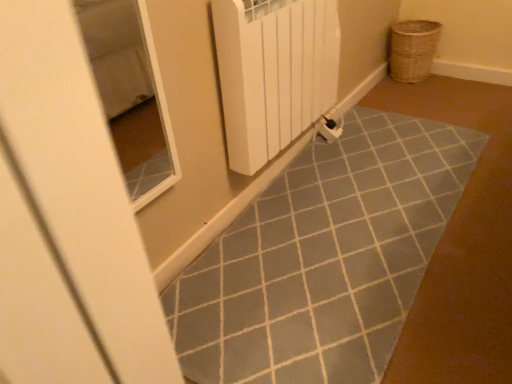
Image resolution: width=512 pixels, height=384 pixels. In order to click on white plastic radiator at center in this screenshot , I will do `click(273, 73)`.

Describe the element at coordinates (273, 73) in the screenshot. This screenshot has width=512, height=384. I see `white plastic radiator at center` at that location.

The height and width of the screenshot is (384, 512). What do you see at coordinates (412, 50) in the screenshot?
I see `woven brown basket at upper right` at bounding box center [412, 50].

Where is `woven brown basket at upper right`? This screenshot has width=512, height=384. woven brown basket at upper right is located at coordinates (412, 50).

The image size is (512, 384). I want to click on white plastic radiator at center, so click(x=273, y=73).

Is white plastic radiator at center to the right of woven brown basket at upper right from the viewer's perspective?

No, white plastic radiator at center is not to the right of woven brown basket at upper right.

Is white plastic radiator at center positioned behind woven brown basket at upper right?

No.

Considering the points (312, 119) and (420, 42), which point is behind, point (312, 119) or point (420, 42)?

The point (420, 42) is more distant.

From the image's perspective, is white plastic radiator at center positioned above or below woven brown basket at upper right?

From the image's perspective, white plastic radiator at center appears below woven brown basket at upper right.

From a real-world perspective, is white plastic radiator at center over woven brown basket at upper right?

Yes, from a real-world perspective, white plastic radiator at center is above woven brown basket at upper right.

From the picture: Considering the relative sizes of white plastic radiator at center and woven brown basket at upper right in the image provided, is white plastic radiator at center thinner than woven brown basket at upper right?

Yes, white plastic radiator at center is thinner than woven brown basket at upper right.

Does white plastic radiator at center have a greater height compared to woven brown basket at upper right?

Yes, white plastic radiator at center is taller than woven brown basket at upper right.

Is white plastic radiator at center smaller than woven brown basket at upper right?

Actually, white plastic radiator at center might be larger than woven brown basket at upper right.

Which is correct: white plastic radiator at center is inside woven brown basket at upper right, or outside of it?

white plastic radiator at center cannot be found inside woven brown basket at upper right.

Is white plastic radiator at center beside woven brown basket at upper right?

white plastic radiator at center is not next to woven brown basket at upper right, and they're not touching.

Is white plastic radiator at center aimed at woven brown basket at upper right?

No, white plastic radiator at center is not oriented towards woven brown basket at upper right.

What's the angular difference between white plastic radiator at center and woven brown basket at upper right's facing directions?

There is a 0.000376-degree angle between the facing directions of white plastic radiator at center and woven brown basket at upper right.

Where is `basket that appears below the white plastic radiator at center (from a real-world perspective)`? This screenshot has height=384, width=512. basket that appears below the white plastic radiator at center (from a real-world perspective) is located at coordinates (412, 50).

Considering the positions of objects woven brown basket at upper right and white plastic radiator at center in the image provided, who is more to the right, woven brown basket at upper right or white plastic radiator at center?

From the viewer's perspective, woven brown basket at upper right appears more on the right side.

Is woven brown basket at upper right closer to camera compared to white plastic radiator at center?

No, the depth of woven brown basket at upper right is greater than that of white plastic radiator at center.

Is point (404, 79) in front of point (241, 128)?

That is False.

From the image's perspective, is woven brown basket at upper right under white plastic radiator at center?

Actually, woven brown basket at upper right appears above white plastic radiator at center in the image.

From a real-world perspective, is woven brown basket at upper right over white plastic radiator at center?

No, from a real-world perspective, woven brown basket at upper right is not over white plastic radiator at center

Looking at this image, which object is thinner, woven brown basket at upper right or white plastic radiator at center?

white plastic radiator at center.

Which of these two, woven brown basket at upper right or white plastic radiator at center, stands taller?

Standing taller between the two is white plastic radiator at center.

Considering the sizes of objects woven brown basket at upper right and white plastic radiator at center in the image provided, who is bigger, woven brown basket at upper right or white plastic radiator at center?

white plastic radiator at center is bigger.

Would you say woven brown basket at upper right is inside or outside white plastic radiator at center?

woven brown basket at upper right exists outside the volume of white plastic radiator at center.

Consider the image. Is woven brown basket at upper right with white plastic radiator at center?

No, woven brown basket at upper right is not next to white plastic radiator at center.

Is woven brown basket at upper right turned away from white plastic radiator at center?

No, woven brown basket at upper right's orientation is not away from white plastic radiator at center.

Can you tell me how much woven brown basket at upper right and white plastic radiator at center differ in facing direction?

The facing directions of woven brown basket at upper right and white plastic radiator at center are 0.000376 degrees apart.

Based on the photo, measure the distance between woven brown basket at upper right and white plastic radiator at center.

woven brown basket at upper right and white plastic radiator at center are 3.94 feet apart.

The height and width of the screenshot is (384, 512). In order to click on radiator above the woven brown basket at upper right (from a real-world perspective) in this screenshot , I will do `click(273, 73)`.

In order to click on basket on the right of the white plastic radiator at center in this screenshot , I will do `click(412, 50)`.

Image resolution: width=512 pixels, height=384 pixels. In order to click on radiator located in front of the woven brown basket at upper right in this screenshot , I will do `click(273, 73)`.